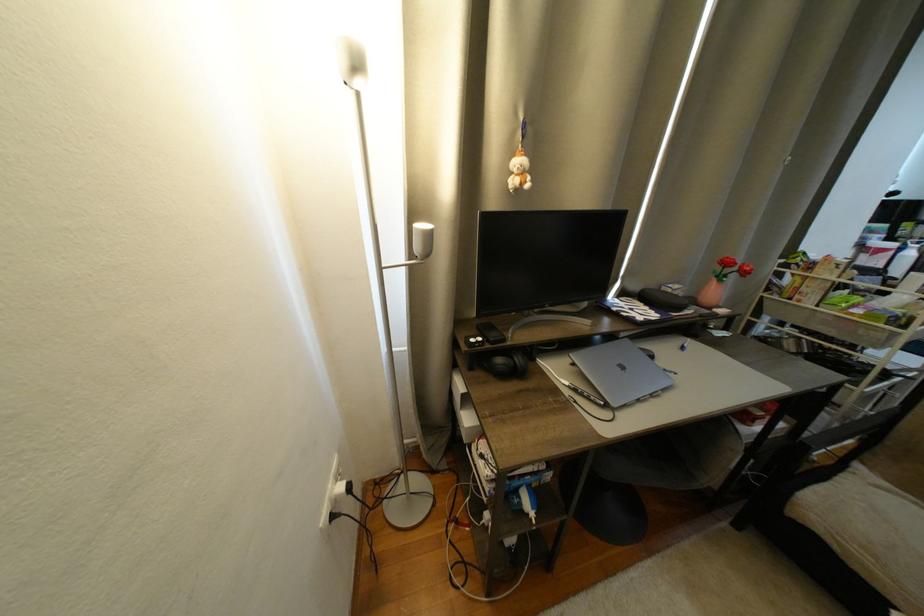
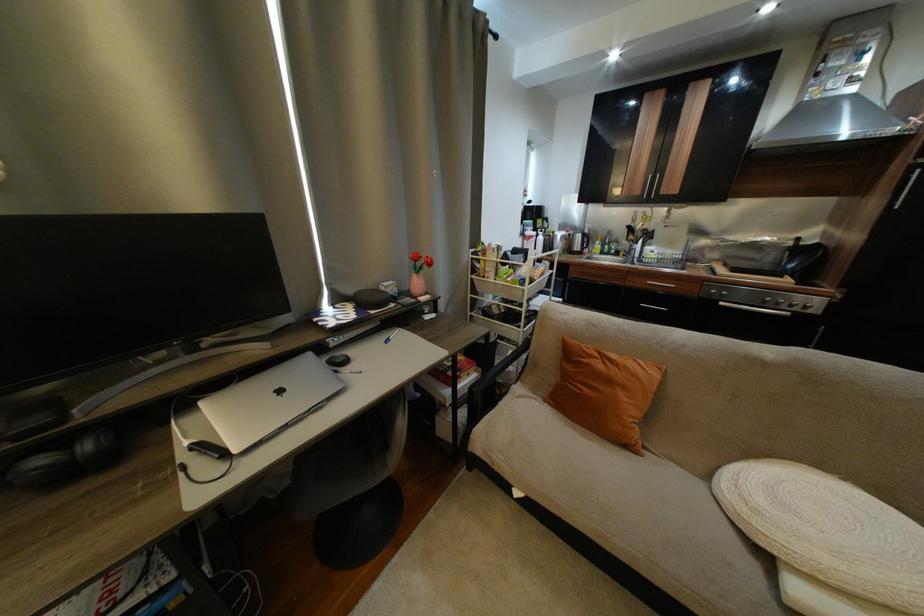
Question: The camera is either moving clockwise (left) or counter-clockwise (right) around the object. The first image is from the beginning of the video and the second image is from the end. Is the camera moving left or right when shooting the video?

Choices:
 (A) Left
 (B) Right

Answer: (A)